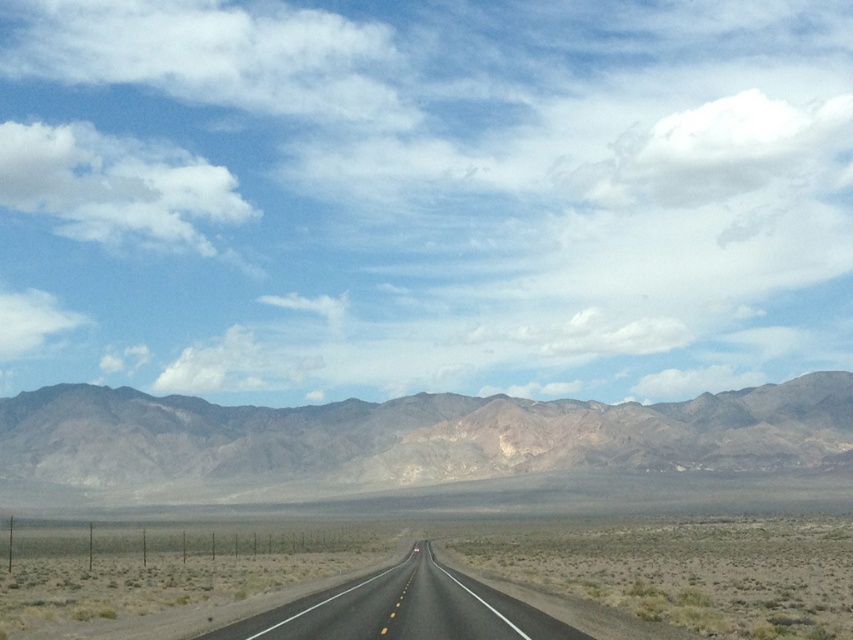
The image size is (853, 640). Find the location of `brown rocky mountain at center`. brown rocky mountain at center is located at coordinates (392, 440).

Does brown rocky mountain at center appear on the right side of black asphalt road at center?

No, brown rocky mountain at center is not to the right of black asphalt road at center.

Find the location of a particular element. brown rocky mountain at center is located at coordinates (392, 440).

This screenshot has height=640, width=853. Identify the location of brown rocky mountain at center. (392, 440).